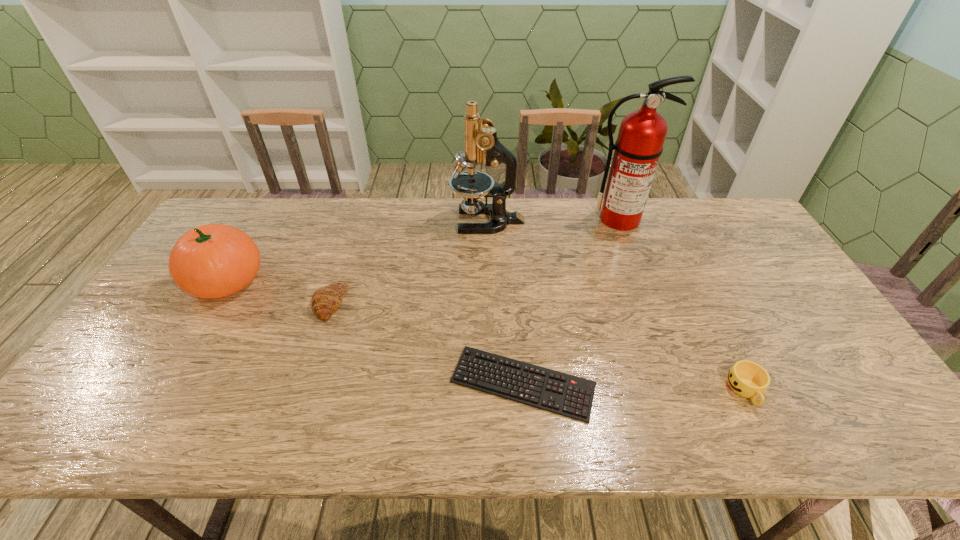
This screenshot has height=540, width=960. Find the location of `free spot located at the eyepiece of the microscope`. free spot located at the eyepiece of the microscope is located at coordinates (430, 221).

You are a GUI agent. You are given a task and a screenshot of the screen. Output one action in this format:
    pyautogui.click(x=<x>, y=<y>)
    Task: Click on the vacant space located 0.190m on the front of the leftmost object
    The width and height of the screenshot is (960, 540).
    Given the screenshot: What is the action you would take?
    pyautogui.click(x=176, y=366)

Locate an element on the screen. free space located 0.330m on the front of the crescent roll is located at coordinates (285, 439).

Locate an element on the screen. blank space located 0.350m on the back of the cup is located at coordinates (688, 273).

This screenshot has height=540, width=960. What are the coordinates of `vacant space located 0.170m on the back of the shortest object` in the screenshot? It's located at (516, 300).

Locate an element on the screen. fire extinguisher at the far edge is located at coordinates (642, 133).

Image resolution: width=960 pixels, height=540 pixels. What are the coordinates of `microscope that is at the far edge` in the screenshot? It's located at (481, 143).

Identify the location of cup that is at the near edge. (748, 379).

The height and width of the screenshot is (540, 960). I want to click on computer keyboard at the near edge, so click(x=564, y=394).

You are a GUI agent. You are given a task and a screenshot of the screen. Output one action in this format:
    pyautogui.click(x=<x>, y=<y>)
    Task: Click on the object present at the left edge
    
    Given the screenshot: What is the action you would take?
    pyautogui.click(x=211, y=261)